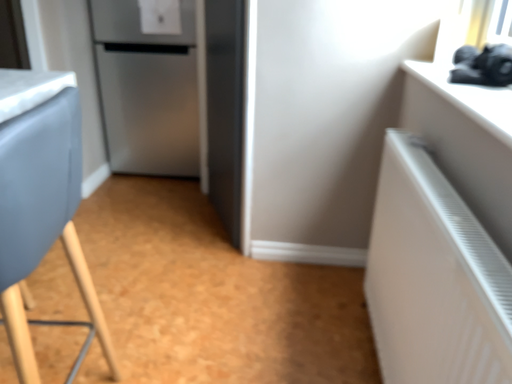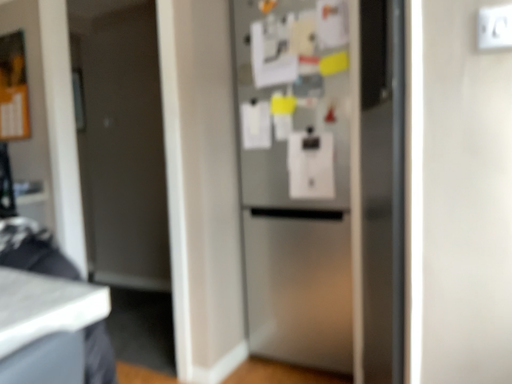
Question: How did the camera likely rotate when shooting the video?

Choices:
 (A) rotated left
 (B) rotated right

Answer: (A)